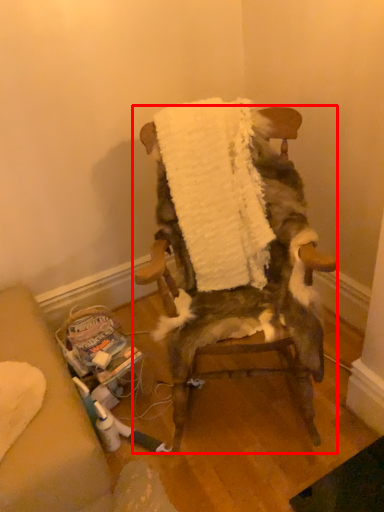
Question: Observing the image, what is the correct spatial positioning of chair (annotated by the red box) in reference to blanket?

Choices:
 (A) left
 (B) right

Answer: (B)